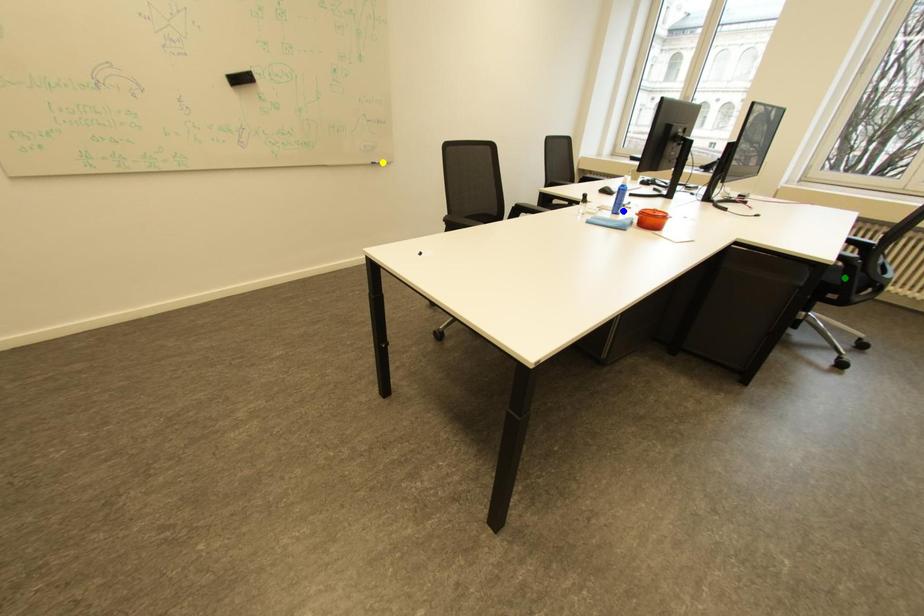
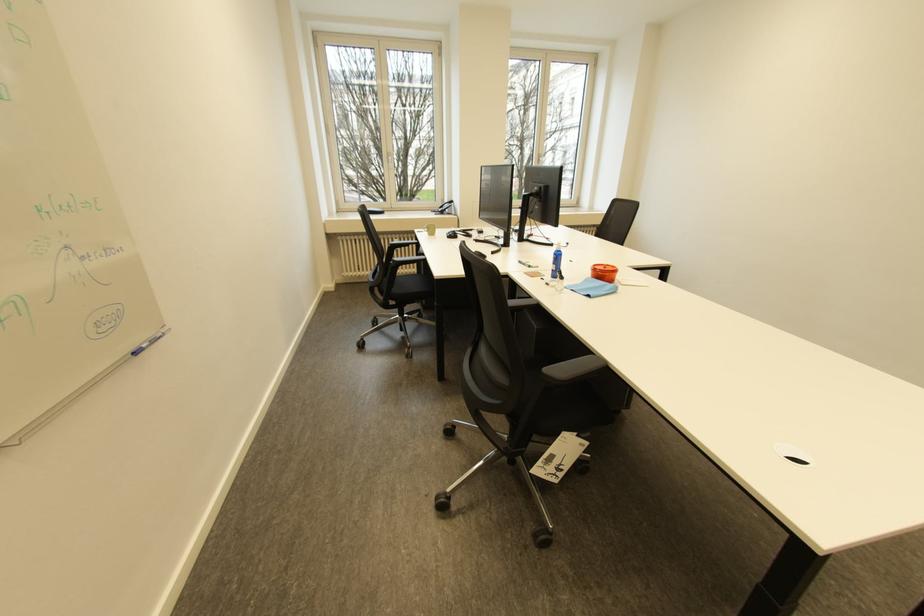
I am providing you with two images of the same scene from different viewpoints. Three points are marked in image1. Which point corresponds to a part or object that is occluded in image2?In image1, three points are marked. Which of them correspond to a part or object that is occluded in image2?Among the three points shown in image1, which one corresponds to a part or object that is no longer visible due to occlusion in image2?

green point